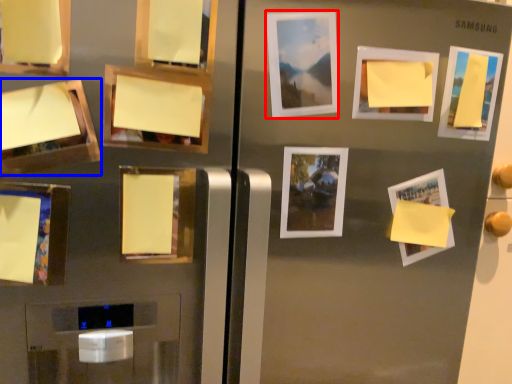
Question: Which of the following is the farthest to the observer, picture frame (highlighted by a red box) or picture frame (highlighted by a blue box)?

Choices:
 (A) picture frame
 (B) picture frame

Answer: (A)